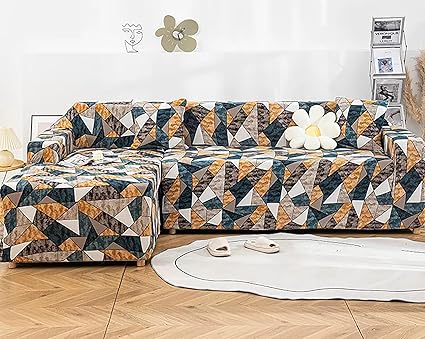
Where is `sofa front legs`? The width and height of the screenshot is (425, 339). sofa front legs is located at coordinates (171, 228), (418, 229).